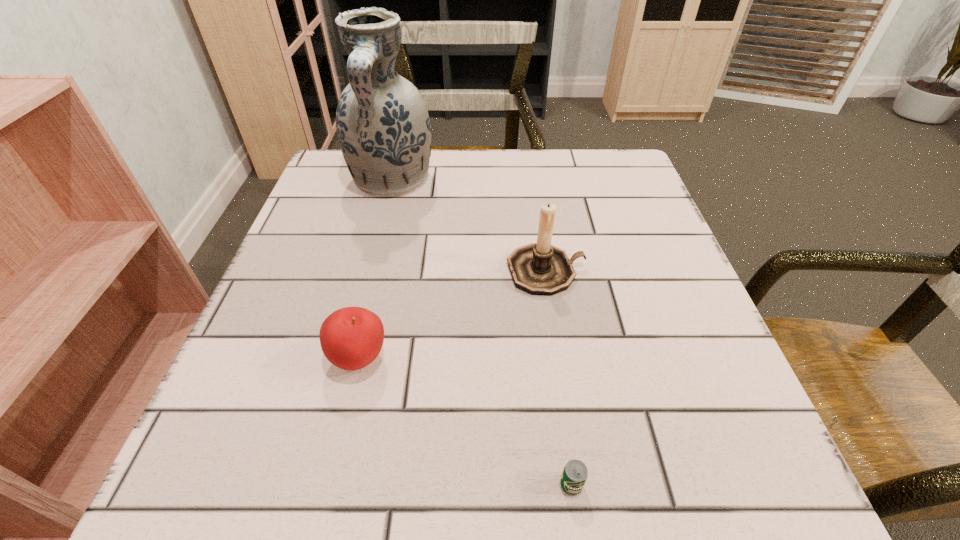
In order to click on empty space that is in between the apple and the third nearest object in this screenshot , I will do `click(452, 315)`.

Where is `vacant point located between the tallest object and the second nearest object`? Image resolution: width=960 pixels, height=540 pixels. vacant point located between the tallest object and the second nearest object is located at coordinates [375, 270].

The image size is (960, 540). In order to click on free space between the nearest object and the tallest object in this screenshot , I will do `click(482, 333)`.

Choose which object is the nearest neighbor to the third shortest object. Please provide its 2D coordinates. Your answer should be formatted as a tuple, i.e. [(x, y)], where the tuple contains the x and y coordinates of a point satisfying the conditions above.

[(384, 131)]

Image resolution: width=960 pixels, height=540 pixels. What are the coordinates of `object that is the third closest to the shortest object` in the screenshot? It's located at (384, 131).

Image resolution: width=960 pixels, height=540 pixels. Identify the location of free point that satisfies the following two spatial constraints: 1. with the handle on the side of the nearest object; 2. on the left side of the vase. (315, 485).

Where is `free space that satisfies the following two spatial constraints: 1. on the front side of the third tallest object; 2. on the left side of the beer can`? This screenshot has height=540, width=960. free space that satisfies the following two spatial constraints: 1. on the front side of the third tallest object; 2. on the left side of the beer can is located at coordinates (330, 485).

You are a GUI agent. You are given a task and a screenshot of the screen. Output one action in this format:
    pyautogui.click(x=<x>, y=<y>)
    Task: Click on the vacant point that satisfies the following two spatial constraints: 1. on the back side of the third farthest object; 2. on the right side of the third shortest object
    This screenshot has width=960, height=540.
    Given the screenshot: What is the action you would take?
    pyautogui.click(x=379, y=271)

Locate an element on the screen. This screenshot has width=960, height=540. blank space that satisfies the following two spatial constraints: 1. with the handle on the side of the vase; 2. on the left side of the third nearest object is located at coordinates (370, 271).

Identify the location of vacant space that satisfies the following two spatial constraints: 1. with the handle on the side of the tallest object; 2. on the left side of the second nearest object. click(x=347, y=359).